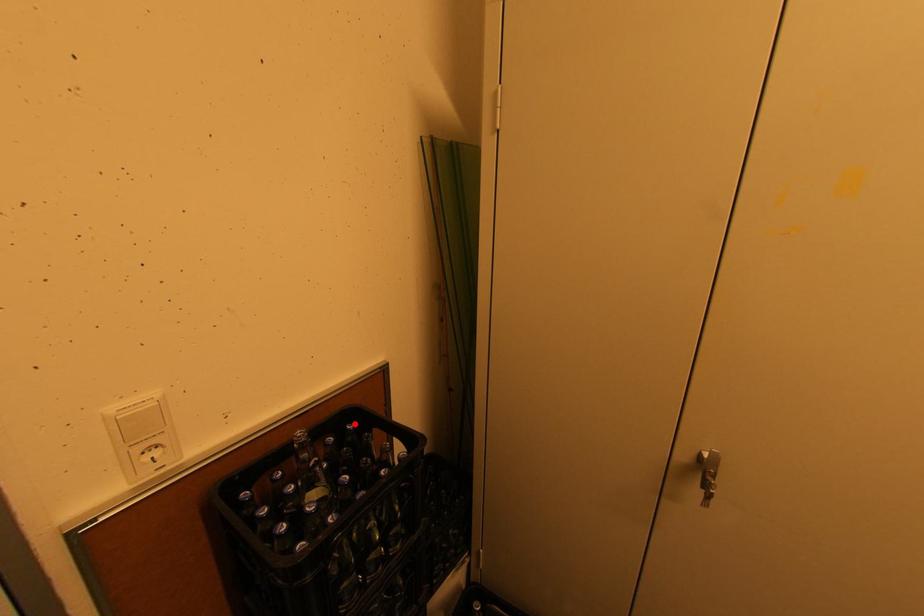
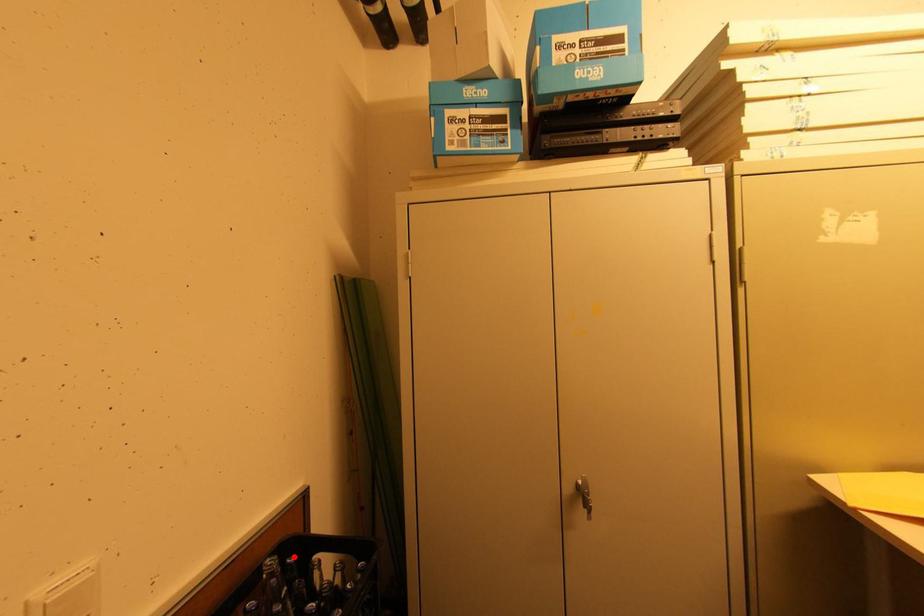
I am providing you with two images of the same scene from different viewpoints. A red point is marked on the first image and another point is marked on the second image. Do the highlighted points in image1 and image2 indicate the same real-world spot?

Yes